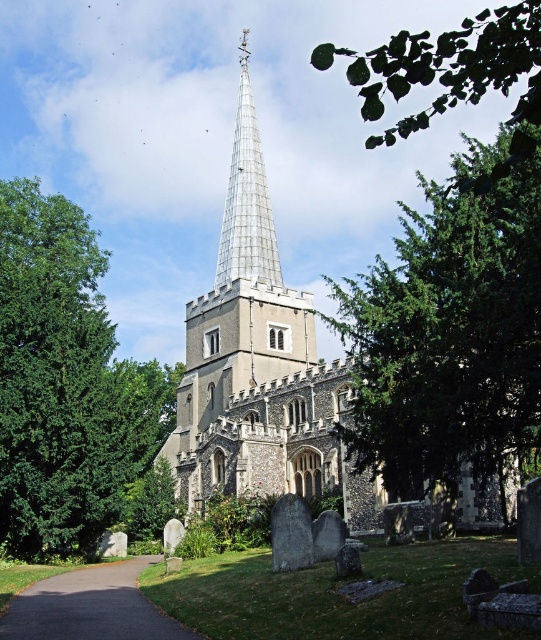
Question: Does gray stone church steeple at center have a greater width compared to green leafy branch at upper right?

Choices:
 (A) yes
 (B) no

Answer: (B)

Question: Among these points, which one is nearest to the camera?

Choices:
 (A) (144, 481)
 (B) (34, 252)
 (C) (38, 592)

Answer: (C)

Question: Does green leafy tree at left appear under brown gravel path at lower left?

Choices:
 (A) yes
 (B) no

Answer: (B)

Question: Is green leafy tree at right behind green leafy tree at lower center?

Choices:
 (A) no
 (B) yes

Answer: (A)

Question: Which point is farther to the camera?

Choices:
 (A) (143, 560)
 (B) (197, 300)
 (C) (54, 538)
 (D) (322, 316)

Answer: (B)

Question: Which of the following is the farthest from the observer?

Choices:
 (A) (166, 476)
 (B) (222, 214)
 (C) (3, 282)
 (D) (453, 355)

Answer: (B)